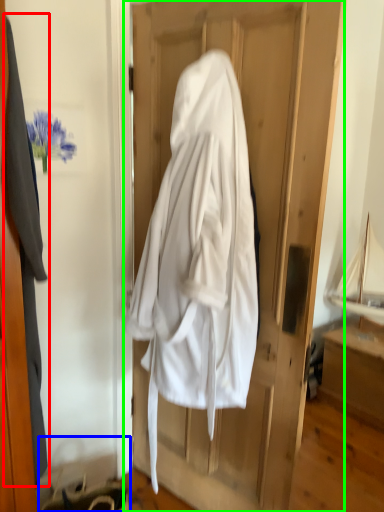
Question: Based on their relative distances, which object is farther from garment (highlighted by a red box)? Choose from hanger (highlighted by a blue box) and door (highlighted by a green box).

Choices:
 (A) hanger
 (B) door

Answer: (B)